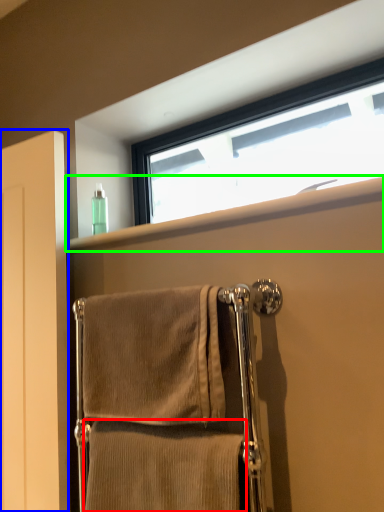
Question: Estimate the real-world distances between objects in this image. Which object is farther from towel (highlighted by a red box), screen door (highlighted by a blue box) or window sill (highlighted by a green box)?

Choices:
 (A) screen door
 (B) window sill

Answer: (B)